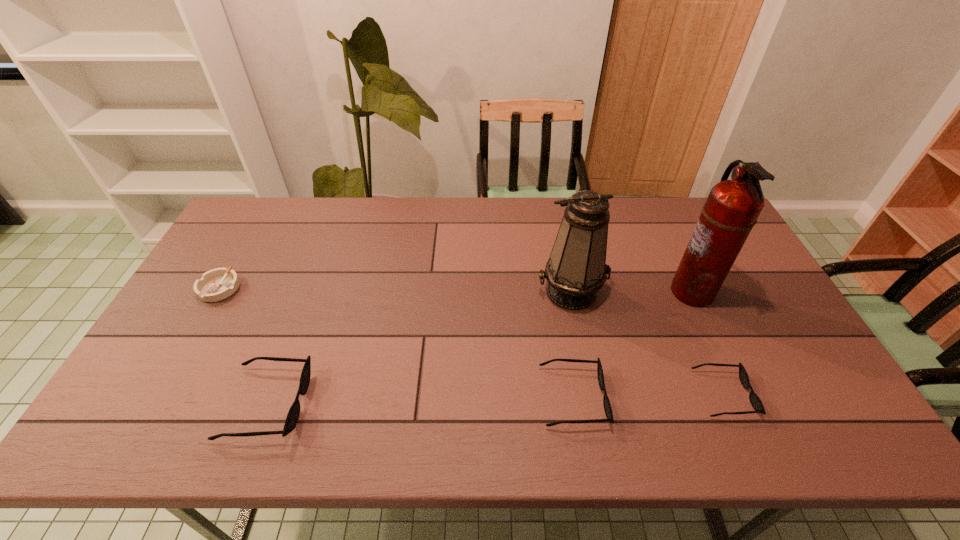
You are a GUI agent. You are given a task and a screenshot of the screen. Output one action in this format:
    pyautogui.click(x=<x>, y=<y>)
    Task: Click on the vacant space at the left edge of the desktop
    
    Given the screenshot: What is the action you would take?
    pyautogui.click(x=175, y=323)

This screenshot has height=540, width=960. In order to click on vacant space at the right edge of the desktop in this screenshot , I will do `click(791, 336)`.

At what (x,y) coordinates should I click in order to perform the action: click on free area in between the tallest object and the second object from left to right. Please return your answer as a coordinate pair (x, y). This screenshot has width=960, height=540. Looking at the image, I should click on (479, 347).

The height and width of the screenshot is (540, 960). I want to click on unoccupied position between the third shortest object and the tallest object, so click(x=632, y=344).

Locate an element on the screen. The image size is (960, 540). vacant space that's between the second tallest sunglasses and the shortest sunglasses is located at coordinates (648, 395).

Where is `free space that is in between the shortest sunglasses and the fifth shortest object`? The image size is (960, 540). free space that is in between the shortest sunglasses and the fifth shortest object is located at coordinates (647, 343).

The image size is (960, 540). Find the location of `vacant space that's between the third shortest object and the fire extinguisher`. vacant space that's between the third shortest object and the fire extinguisher is located at coordinates (632, 344).

This screenshot has width=960, height=540. What are the coordinates of `unoccupied area between the tallest sunglasses and the second shortest sunglasses` in the screenshot? It's located at (420, 400).

I want to click on free area in between the shortest sunglasses and the leftmost sunglasses, so click(x=494, y=399).

Locate an element on the screen. Image resolution: width=960 pixels, height=540 pixels. vacant space that is in between the shortest sunglasses and the fourth tallest object is located at coordinates (648, 395).